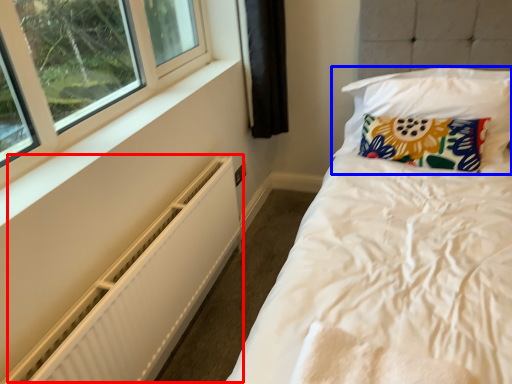
Question: Which point is further to the camera, radiator (highlighted by a red box) or pillow (highlighted by a blue box)?

Choices:
 (A) radiator
 (B) pillow

Answer: (B)